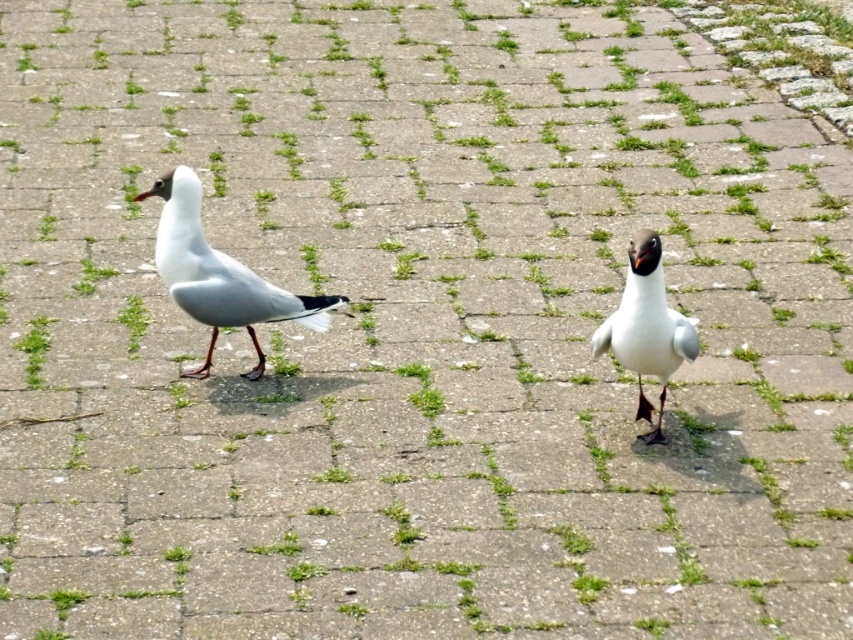
Question: Does white matte bird at left come behind white matte bird at center?

Choices:
 (A) no
 (B) yes

Answer: (B)

Question: Does white matte bird at left appear on the right side of white matte bird at center?

Choices:
 (A) no
 (B) yes

Answer: (A)

Question: Does white matte bird at left have a larger size compared to white matte bird at center?

Choices:
 (A) yes
 (B) no

Answer: (A)